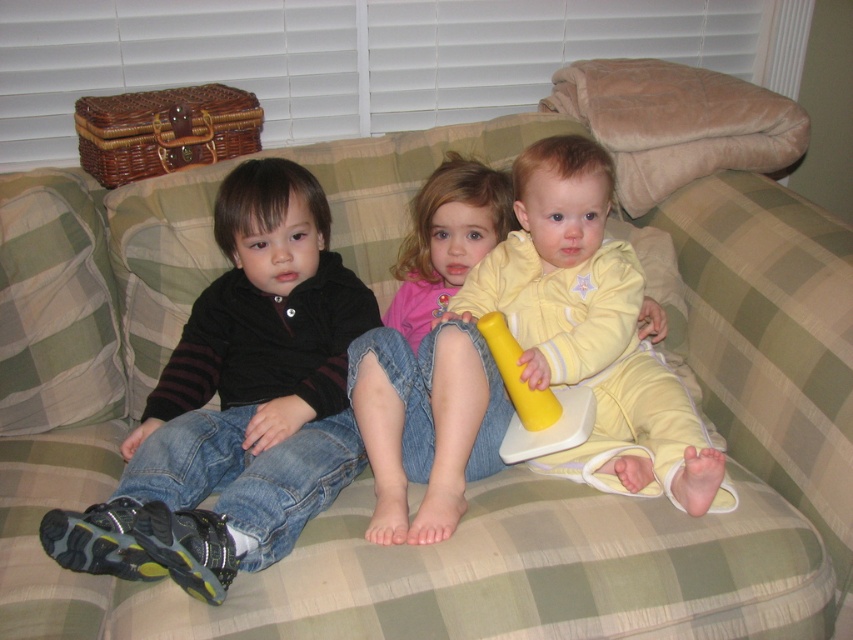
Question: Can you confirm if matte black shirt at left is positioned above pink fabric shirt at center?

Choices:
 (A) yes
 (B) no

Answer: (B)

Question: Is pink fabric pants at center smaller than pink fabric shirt at center?

Choices:
 (A) no
 (B) yes

Answer: (A)

Question: Can you confirm if matte black shirt at left is positioned below pink fabric pants at center?

Choices:
 (A) no
 (B) yes

Answer: (A)

Question: Considering the real-world distances, which object is closest to the matte black shirt at left?

Choices:
 (A) pink fabric pants at center
 (B) yellow rubber hammer at center

Answer: (A)

Question: Which point appears closest to the camera in this image?

Choices:
 (A) (486, 252)
 (B) (463, 211)
 (C) (225, 208)

Answer: (C)

Question: Which point is closer to the camera?

Choices:
 (A) yellow rubber hammer at center
 (B) pink fabric pants at center
 (C) matte black shirt at left
 (D) pink fabric shirt at center

Answer: (C)